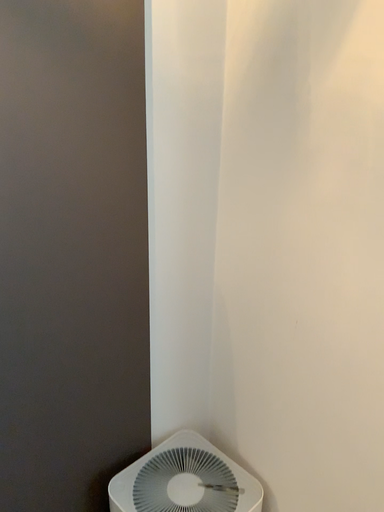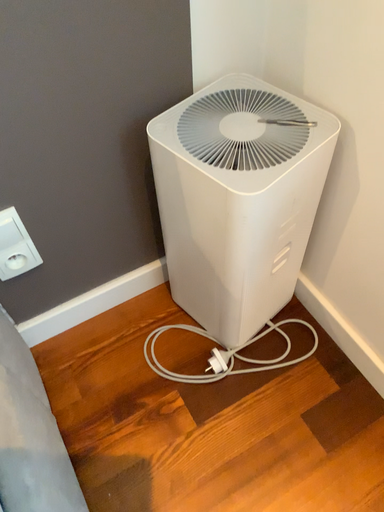
Question: How did the camera likely rotate when shooting the video?

Choices:
 (A) rotated downward
 (B) rotated upward

Answer: (A)